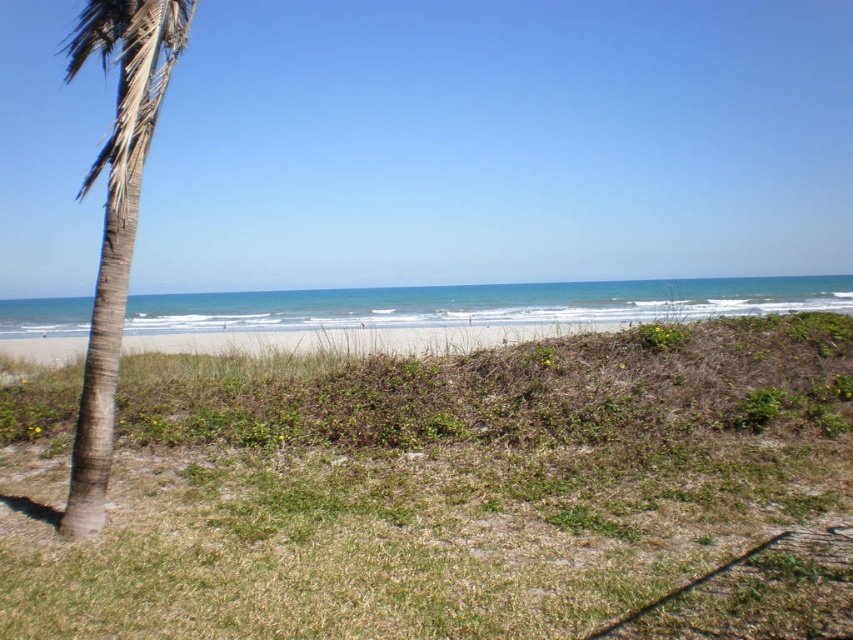
You are planning to set up a small tent on the beach. You have two options for the location based on the image provided. The first option is near the green grass at lower left, and the second option is near the brown textured palm tree at left. Considering the space available, which location would provide more room for your tent?

The brown textured palm tree at left occupies more space than the green grass at lower left, so setting up the tent near the brown textured palm tree at left would provide more room for your tent.

You are standing on the beach and want to place a small garden statue that requires a height of at least 1 meter. Which area between the green grass at lower left and the brown textured palm tree at left would be suitable for placing the statue based on their heights?

The brown textured palm tree at left has a greater height than the green grass at lower left. Since the statue requires at least 1 meter in height, the area near the brown textured palm tree at left would be more suitable as it likely meets the height requirement.